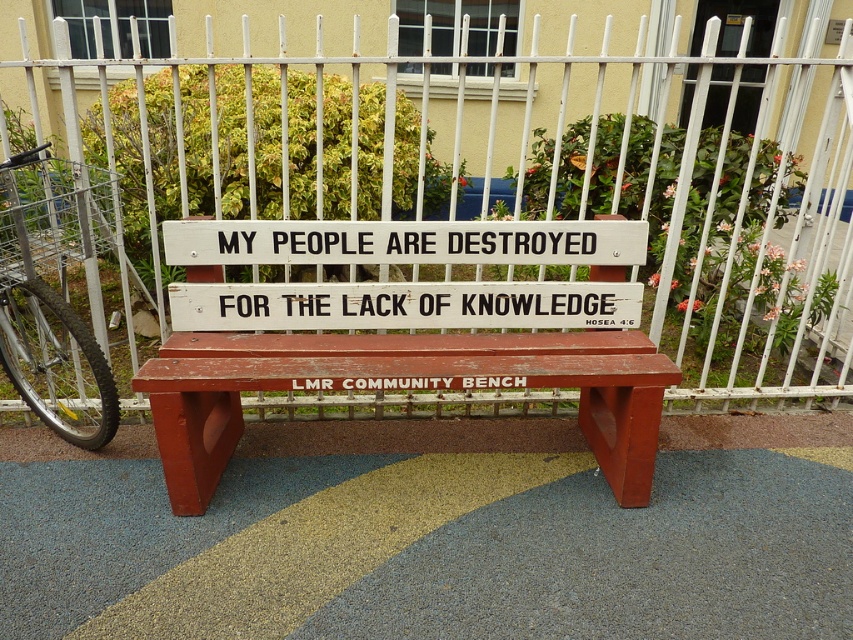
Question: Is wooden bench at center bigger than white wood sign at center?

Choices:
 (A) yes
 (B) no

Answer: (A)

Question: Which point is closer to the camera?

Choices:
 (A) (181, 394)
 (B) (74, 209)
 (C) (308, 225)

Answer: (A)

Question: Considering the real-world distances, which object is closest to the wooden bench at center?

Choices:
 (A) white metal fence at center
 (B) silver metallic bicycle at left
 (C) white wood sign at center

Answer: (C)

Question: Which point appears closest to the camera in this image?

Choices:
 (A) (625, 285)
 (B) (354, 312)
 (C) (451, 304)

Answer: (B)

Question: Where is wooden bench at center located in relation to silver metallic bicycle at left in the image?

Choices:
 (A) right
 (B) left

Answer: (A)

Question: Can you confirm if white metal fence at center is positioned to the left of silver metallic bicycle at left?

Choices:
 (A) no
 (B) yes

Answer: (A)